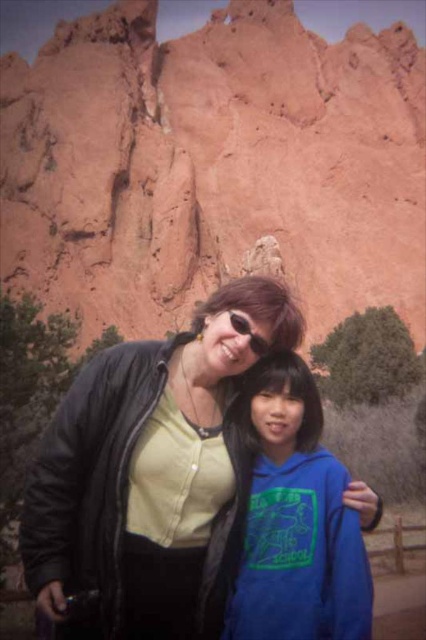
Between black leather jacket at center and blue fleece hoodie at center, which one is positioned lower?

blue fleece hoodie at center is lower down.

Does point (270, 282) come farther from viewer compared to point (262, 435)?

Yes, it is.

This screenshot has height=640, width=426. Identify the location of black leather jacket at center. (149, 461).

What do you see at coordinates (296, 522) in the screenshot? Image resolution: width=426 pixels, height=640 pixels. I see `blue fleece hoodie at center` at bounding box center [296, 522].

What do you see at coordinates (296, 522) in the screenshot?
I see `blue fleece hoodie at center` at bounding box center [296, 522].

Identify the location of blue fleece hoodie at center. The image size is (426, 640). click(x=296, y=522).

How much distance is there between rustic rock formation at upper center and blue fleece hoodie at center?

rustic rock formation at upper center and blue fleece hoodie at center are 215.04 feet apart from each other.

Measure the distance between point (3, 64) and camera.

The distance of point (3, 64) from camera is 375.52 feet.

Is point (305, 125) farther from camera compared to point (285, 474)?

Yes, it is behind point (285, 474).

The width and height of the screenshot is (426, 640). Identify the location of rustic rock formation at upper center. (213, 164).